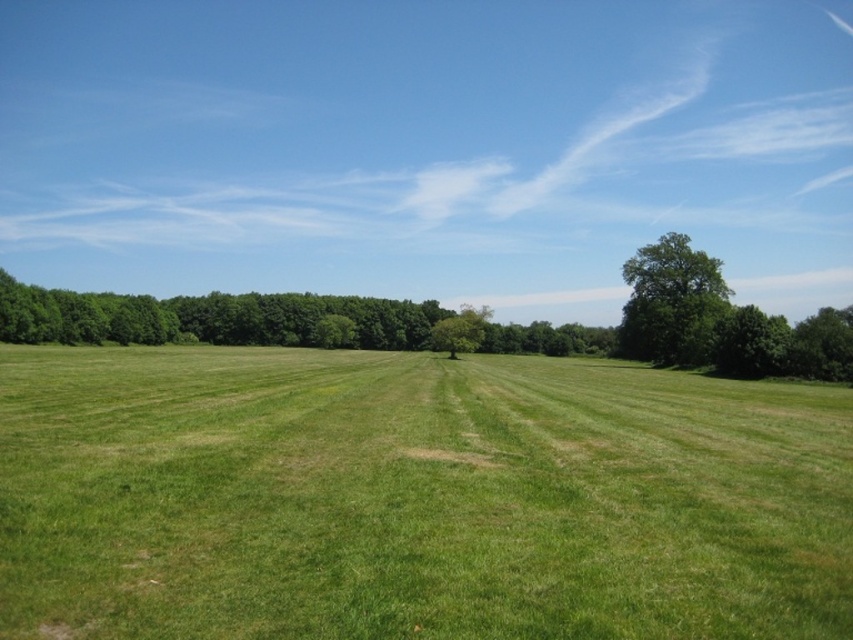
Where is `green leafy tree at left`? The image size is (853, 640). green leafy tree at left is located at coordinates (210, 317).

The width and height of the screenshot is (853, 640). Describe the element at coordinates (210, 317) in the screenshot. I see `green leafy tree at left` at that location.

The width and height of the screenshot is (853, 640). I want to click on green leafy tree at left, so (210, 317).

Who is more distant from viewer, (717, 513) or (146, 314)?

The point (146, 314) is behind.

Is point (78, 544) behind point (393, 333)?

No, it is in front of (393, 333).

The height and width of the screenshot is (640, 853). In order to click on green grassy field at center in this screenshot , I will do `click(415, 497)`.

Is point (155, 564) behind point (641, 262)?

No, (155, 564) is closer to viewer.

The width and height of the screenshot is (853, 640). What do you see at coordinates (415, 497) in the screenshot? I see `green grassy field at center` at bounding box center [415, 497].

Find the location of `green grassy field at center`. green grassy field at center is located at coordinates (415, 497).